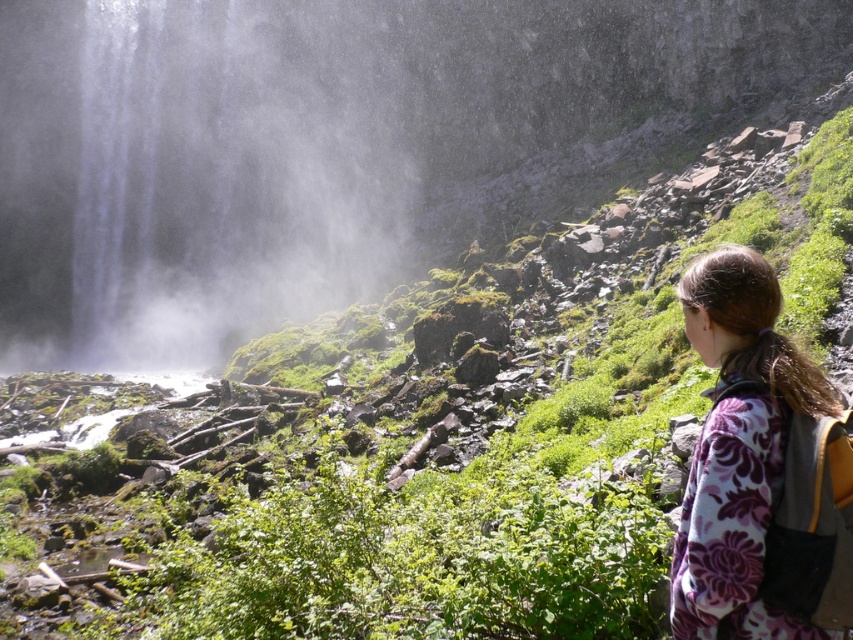
Is white misty waterfall at upper left shorter than floral fleece jacket at lower right?

In fact, white misty waterfall at upper left may be taller than floral fleece jacket at lower right.

Between white misty waterfall at upper left and floral fleece jacket at lower right, which one appears on the left side from the viewer's perspective?

Positioned to the left is white misty waterfall at upper left.

Describe the element at coordinates (234, 170) in the screenshot. The width and height of the screenshot is (853, 640). I see `white misty waterfall at upper left` at that location.

The height and width of the screenshot is (640, 853). Find the location of `white misty waterfall at upper left`. white misty waterfall at upper left is located at coordinates (234, 170).